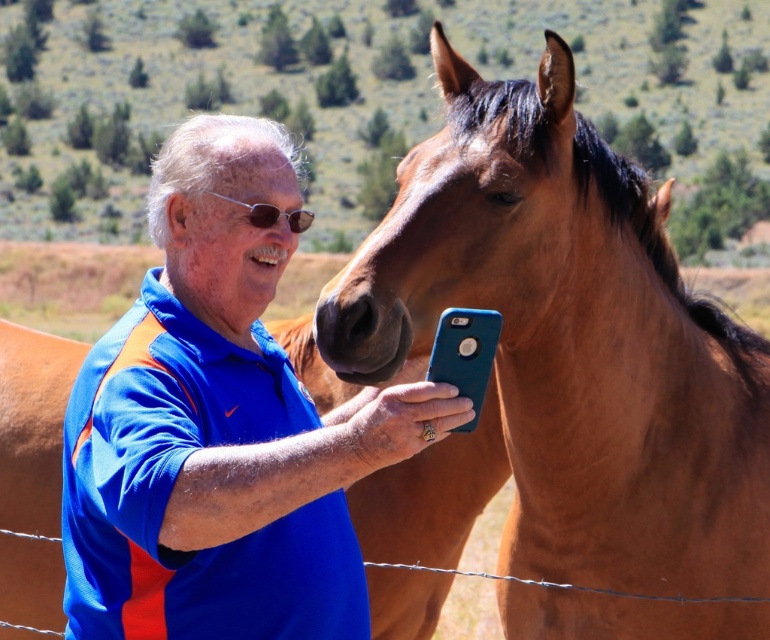
You are a photographer trying to capture a photo of the brown matte horse at center and the sunglasses at center. Based on their positions, which object is blocking the other from view?

The brown matte horse at center is positioned under the sunglasses at center, so the horse is blocking the sunglasses from view.

You are a photographer trying to capture a group photo of the brown matte horse at center and the blue fabric shirt at center. If you want to ensure both subjects are fully in frame, which subject requires more horizontal space in the camera frame?

The brown matte horse at center might be wider than blue fabric shirt at center, so it requires more horizontal space in the camera frame to ensure it is fully captured.

You are a photographer trying to capture a candid shot of the man and horse. You notice the blue fabric shirt at center and sunglasses at center. Which item is positioned lower on the man?

The blue fabric shirt at center is located below sunglasses at center, so the blue fabric shirt at center is positioned lower on the man.